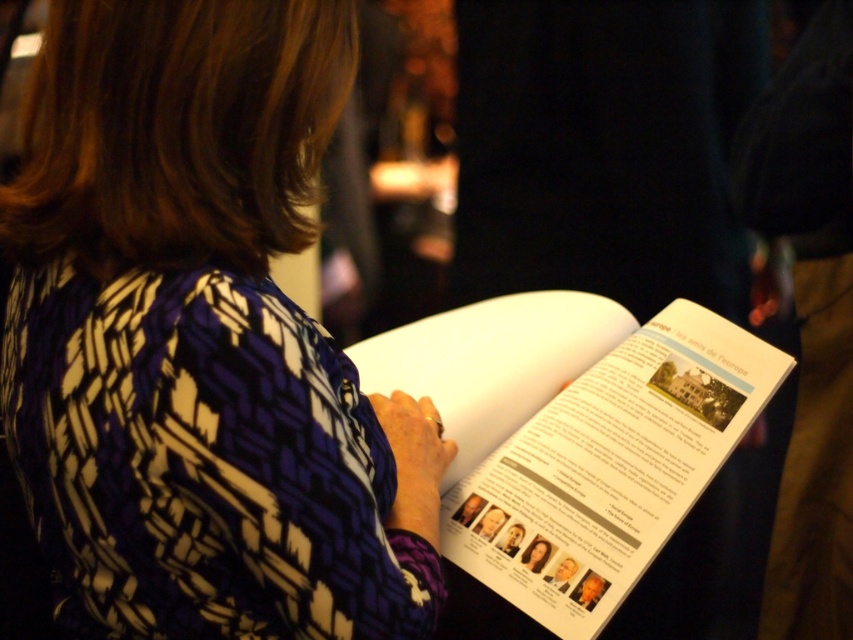
Question: Does printed fabric shirt at center appear over white paper book at center?

Choices:
 (A) yes
 (B) no

Answer: (A)

Question: Among these objects, which one is farthest from the camera?

Choices:
 (A) white paper book at center
 (B) printed fabric shirt at center

Answer: (A)

Question: Among these objects, which one is nearest to the camera?

Choices:
 (A) printed fabric shirt at center
 (B) white paper book at center

Answer: (A)

Question: In this image, where is printed fabric shirt at center located relative to white paper book at center?

Choices:
 (A) above
 (B) below

Answer: (A)

Question: Is printed fabric shirt at center positioned in front of white paper book at center?

Choices:
 (A) no
 (B) yes

Answer: (B)

Question: Which point appears closest to the camera in this image?

Choices:
 (A) (669, 518)
 (B) (19, 408)

Answer: (B)